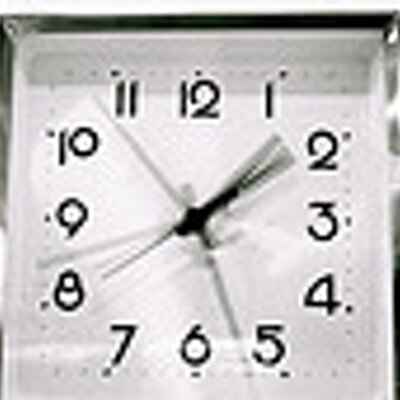
The image size is (400, 400). Find the location of `wall clock`. wall clock is located at coordinates (247, 245).